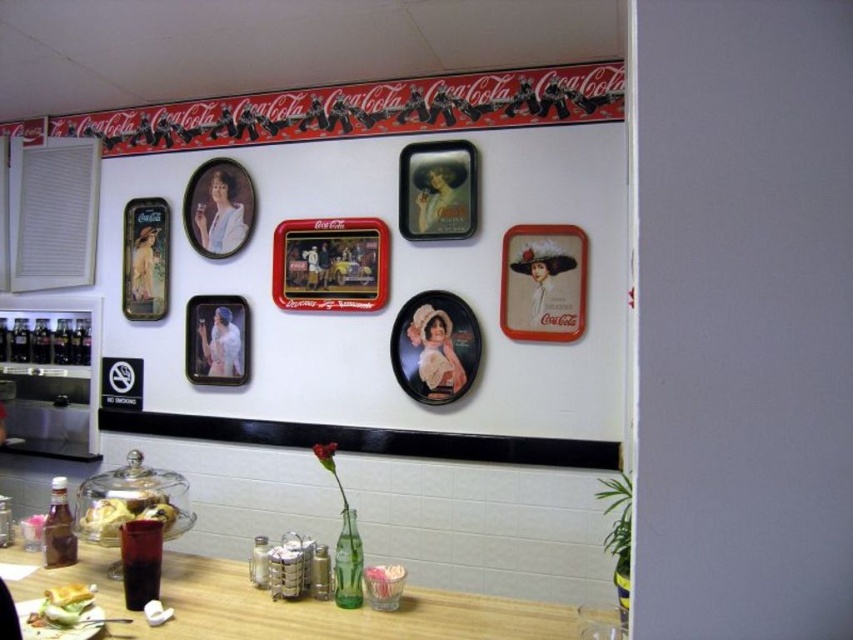
You are a server in this diner and need to place a new menu on the counter. The menu is 12 inches wide. You see the metallic rectangular tray at center and the matte black rectangular frame at upper left. Which object can the menu fit next to without overlapping?

The menu can fit next to the metallic rectangular tray at center because it might be wider than the matte black rectangular frame at upper left, providing enough space.

You are a customer sitting at the diner counter and want to point out two specific points on the wall. The first point is at coordinates point (287, 248) and the second is at point (442, 225). Which of these two points is closer to you?

Point (287, 248) is further to the viewer than point (442, 225), so the point closer to you is point (442, 225).

You are a customer in the diner and want to place your phone on the translucent glass bowl at lower left. Where exactly should you aim to place it?

You should aim to place your phone at point (122, 513) on the translucent glass bowl at lower left.